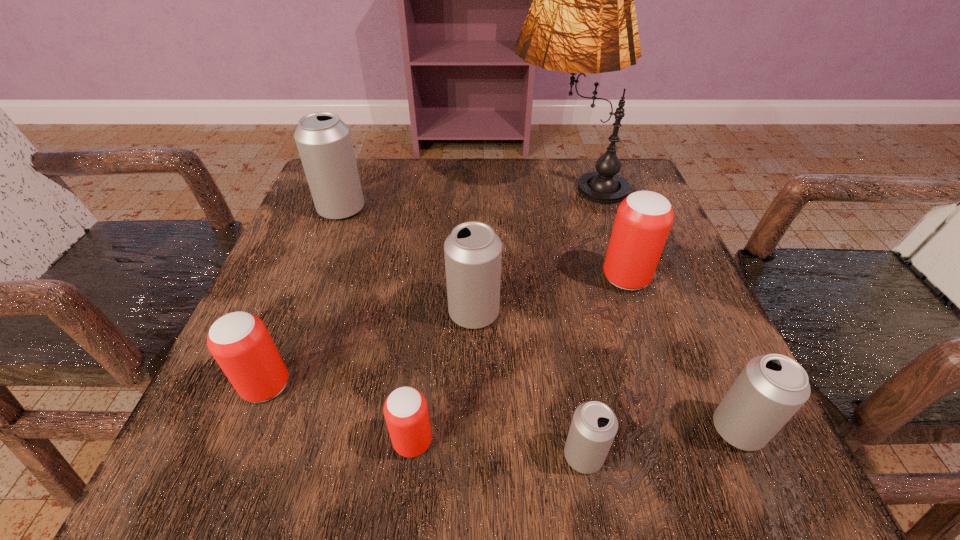
The height and width of the screenshot is (540, 960). In order to click on vacant space situated 0.240m on the left of the second farthest white beer can in this screenshot , I will do `click(304, 313)`.

In order to click on vacant space located on the right of the second farthest red beer can in this screenshot , I will do `click(444, 386)`.

Image resolution: width=960 pixels, height=540 pixels. I want to click on vacant space located 0.170m on the left of the rightmost white beer can, so coord(585,429).

Find the location of a particular element. The height and width of the screenshot is (540, 960). vacant space positioned on the left of the nearest red beer can is located at coordinates (208, 441).

This screenshot has width=960, height=540. What are the coordinates of `blank area located 0.110m on the right of the second white beer can from right to left` in the screenshot? It's located at (690, 456).

At what (x,y) coordinates should I click in order to perform the action: click on lampshade located in the far edge section of the desktop. Please return your answer as a coordinate pair (x, y). Looking at the image, I should click on (582, 19).

Find the location of a particular element. This screenshot has width=960, height=540. beer can that is positioned at the far edge is located at coordinates (324, 143).

You are a GUI agent. You are given a task and a screenshot of the screen. Output one action in this format:
    pyautogui.click(x=<x>, y=<y>)
    Task: Click on the lampshade at the right edge
    Image resolution: width=960 pixels, height=540 pixels.
    Given the screenshot: What is the action you would take?
    pyautogui.click(x=582, y=19)

Where is `object that is at the far left corner`? The image size is (960, 540). object that is at the far left corner is located at coordinates (324, 143).

You are a GUI agent. You are given a task and a screenshot of the screen. Output one action in this format:
    pyautogui.click(x=<x>, y=<y>)
    Task: Click on the object present at the far right corner
    This screenshot has height=540, width=960.
    Given the screenshot: What is the action you would take?
    pyautogui.click(x=582, y=19)